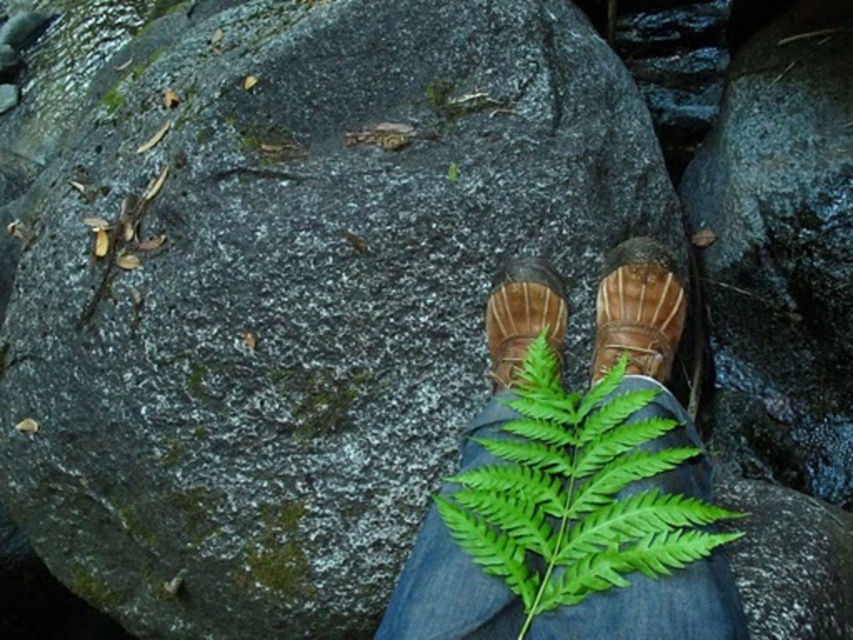
Question: Can you confirm if green leafy plant at center is wider than brown suede shoe at center?

Choices:
 (A) yes
 (B) no

Answer: (A)

Question: Is green leafy plant at center positioned at the back of brown suede shoe at center?

Choices:
 (A) yes
 (B) no

Answer: (B)

Question: Which object appears closest to the camera in this image?

Choices:
 (A) green leafy plant at center
 (B) brown suede shoe at center
 (C) brown leather boot at center

Answer: (A)

Question: Observing the image, what is the correct spatial positioning of green leafy plant at center in reference to brown leather boot at center?

Choices:
 (A) left
 (B) right

Answer: (A)

Question: Which point is farther to the camera?

Choices:
 (A) brown suede shoe at center
 (B) green leafy plant at center

Answer: (A)

Question: Which is nearer to the green leafy plant at center?

Choices:
 (A) brown suede shoe at center
 (B) brown leather boot at center

Answer: (B)